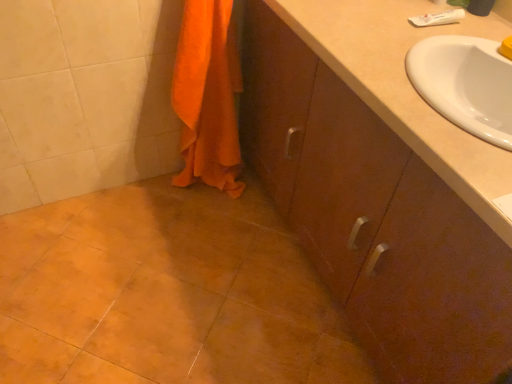
Question: Considering the positions of orange cotton towel at lower left and matte brown cabinet at center in the image, is orange cotton towel at lower left wider or thinner than matte brown cabinet at center?

Choices:
 (A) thin
 (B) wide

Answer: (A)

Question: In the image, is orange cotton towel at lower left positioned in front of or behind matte brown cabinet at center?

Choices:
 (A) front
 (B) behind

Answer: (B)

Question: From their relative heights in the image, would you say orange cotton towel at lower left is taller or shorter than matte brown cabinet at center?

Choices:
 (A) tall
 (B) short

Answer: (B)

Question: From a real-world perspective, is matte brown cabinet at center positioned above or below orange cotton towel at lower left?

Choices:
 (A) above
 (B) below

Answer: (B)

Question: Is matte brown cabinet at center wider or thinner than orange cotton towel at lower left?

Choices:
 (A) wide
 (B) thin

Answer: (A)

Question: Is matte brown cabinet at center inside or outside of orange cotton towel at lower left?

Choices:
 (A) outside
 (B) inside

Answer: (A)

Question: Relative to orange cotton towel at lower left, is matte brown cabinet at center in front or behind?

Choices:
 (A) behind
 (B) front

Answer: (B)